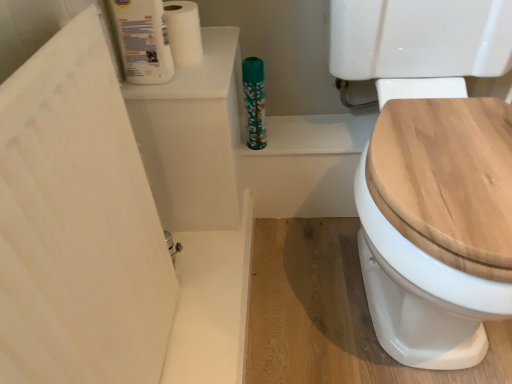
Measure the distance between point (247, 72) and camera.

→ The distance of point (247, 72) from camera is 38.90 inches.

Identify the location of white glossy toilet paper at upper left, the first toilet paper in the front-to-back sequence. (156, 38).

You are a GUI agent. You are given a task and a screenshot of the screen. Output one action in this format:
    pyautogui.click(x=<x>, y=<y>)
    Task: Click on the teal floral-patterned bottle at upper center
    
    Given the screenshot: What is the action you would take?
    pyautogui.click(x=254, y=101)

From a real-world perspective, is white matte toilet paper at upper left, the first toilet paper in the back-to-front sequence, on teal floral-patterned bottle at upper center?

Yes, from a real-world perspective, white matte toilet paper at upper left, the first toilet paper in the back-to-front sequence, is over teal floral-patterned bottle at upper center

Is white matte toilet paper at upper left, positioned as the second toilet paper in front-to-back order, facing towards teal floral-patterned bottle at upper center?

No, white matte toilet paper at upper left, positioned as the second toilet paper in front-to-back order, is not turned towards teal floral-patterned bottle at upper center.

Considering the sizes of objects white matte toilet paper at upper left, the first toilet paper in the back-to-front sequence, and teal floral-patterned bottle at upper center in the image provided, who is smaller, white matte toilet paper at upper left, the first toilet paper in the back-to-front sequence, or teal floral-patterned bottle at upper center?

Smaller between the two is teal floral-patterned bottle at upper center.

Would you say teal floral-patterned bottle at upper center is part of white matte toilet paper at upper left, positioned as the second toilet paper in front-to-back order,'s contents?

No, teal floral-patterned bottle at upper center is not a part of white matte toilet paper at upper left, positioned as the second toilet paper in front-to-back order.

From a real-world perspective, is white matte toilet paper at upper left, positioned as the second toilet paper in front-to-back order, located beneath white glossy toilet paper at upper left, placed as the second toilet paper when sorted from back to front?

Correct, in the physical world, white matte toilet paper at upper left, positioned as the second toilet paper in front-to-back order, is lower than white glossy toilet paper at upper left, placed as the second toilet paper when sorted from back to front.

Is white matte toilet paper at upper left, positioned as the second toilet paper in front-to-back order, next to white glossy toilet paper at upper left, the first toilet paper in the front-to-back sequence?

Yes, white matte toilet paper at upper left, positioned as the second toilet paper in front-to-back order, is next to white glossy toilet paper at upper left, the first toilet paper in the front-to-back sequence.

Does point (168, 12) come behind point (141, 15)?

Yes, point (168, 12) is behind point (141, 15).

Who is bigger, teal floral-patterned bottle at upper center or wooden toilet seat at right?

wooden toilet seat at right.

Considering the sizes of objects teal floral-patterned bottle at upper center and wooden toilet seat at right in the image provided, who is thinner, teal floral-patterned bottle at upper center or wooden toilet seat at right?

teal floral-patterned bottle at upper center is thinner.

Is teal floral-patterned bottle at upper center positioned beyond the bounds of wooden toilet seat at right?

That's correct, teal floral-patterned bottle at upper center is outside of wooden toilet seat at right.

From their relative heights in the image, would you say teal floral-patterned bottle at upper center is taller or shorter than wooden toilet seat at right?

In the image, teal floral-patterned bottle at upper center appears to be shorter than wooden toilet seat at right.

How far apart are white glossy toilet paper at upper left, the first toilet paper in the front-to-back sequence, and white matte toilet paper at upper left, the first toilet paper in the back-to-front sequence?

A distance of 3.85 centimeters exists between white glossy toilet paper at upper left, the first toilet paper in the front-to-back sequence, and white matte toilet paper at upper left, the first toilet paper in the back-to-front sequence.

Does white glossy toilet paper at upper left, the first toilet paper in the front-to-back sequence, have a greater height compared to white matte toilet paper at upper left, positioned as the second toilet paper in front-to-back order?

Yes, white glossy toilet paper at upper left, the first toilet paper in the front-to-back sequence, is taller than white matte toilet paper at upper left, positioned as the second toilet paper in front-to-back order.

Is point (128, 74) more distant than point (172, 14)?

No, it is in front of (172, 14).

Looking at their sizes, would you say white glossy toilet paper at upper left, placed as the second toilet paper when sorted from back to front, is wider or thinner than white matte toilet paper at upper left, positioned as the second toilet paper in front-to-back order?

Clearly, white glossy toilet paper at upper left, placed as the second toilet paper when sorted from back to front, has less width compared to white matte toilet paper at upper left, positioned as the second toilet paper in front-to-back order.

Between teal floral-patterned bottle at upper center and white glossy toilet paper at upper left, placed as the second toilet paper when sorted from back to front, which one has less height?

Standing shorter between the two is teal floral-patterned bottle at upper center.

Is teal floral-patterned bottle at upper center completely or partially outside of white glossy toilet paper at upper left, placed as the second toilet paper when sorted from back to front?

Yes.

Which is behind, point (254, 87) or point (116, 20)?

The point (254, 87) is behind.

Is white glossy toilet paper at upper left, placed as the second toilet paper when sorted from back to front, at the back of teal floral-patterned bottle at upper center?

teal floral-patterned bottle at upper center is not turned away from white glossy toilet paper at upper left, placed as the second toilet paper when sorted from back to front.

Considering their positions, is wooden toilet seat at right located in front of or behind white glossy toilet paper at upper left, the first toilet paper in the front-to-back sequence?

Clearly, wooden toilet seat at right is in front of white glossy toilet paper at upper left, the first toilet paper in the front-to-back sequence.

From a real-world perspective, relative to white glossy toilet paper at upper left, the first toilet paper in the front-to-back sequence, is wooden toilet seat at right vertically above or below?

wooden toilet seat at right is below white glossy toilet paper at upper left, the first toilet paper in the front-to-back sequence.

Considering the relative sizes of wooden toilet seat at right and white glossy toilet paper at upper left, the first toilet paper in the front-to-back sequence, in the image provided, is wooden toilet seat at right thinner than white glossy toilet paper at upper left, the first toilet paper in the front-to-back sequence,?

Incorrect, the width of wooden toilet seat at right is not less than that of white glossy toilet paper at upper left, the first toilet paper in the front-to-back sequence.

From the image's perspective, which one is positioned higher, wooden toilet seat at right or white glossy toilet paper at upper left, the first toilet paper in the front-to-back sequence?

white glossy toilet paper at upper left, the first toilet paper in the front-to-back sequence, appears higher in the image.

Can you confirm if white glossy toilet paper at upper left, placed as the second toilet paper when sorted from back to front, is positioned to the right of wooden toilet seat at right?

Incorrect, white glossy toilet paper at upper left, placed as the second toilet paper when sorted from back to front, is not on the right side of wooden toilet seat at right.

Are white glossy toilet paper at upper left, the first toilet paper in the front-to-back sequence, and wooden toilet seat at right beside each other?

They are not placed beside each other.

Is point (195, 34) less distant than point (435, 246)?

No, it is behind (435, 246).

Considering the relative sizes of white glossy toilet paper at upper left, the first toilet paper in the front-to-back sequence, and wooden toilet seat at right in the image provided, is white glossy toilet paper at upper left, the first toilet paper in the front-to-back sequence, wider than wooden toilet seat at right?

No, white glossy toilet paper at upper left, the first toilet paper in the front-to-back sequence, is not wider than wooden toilet seat at right.

Find the location of a particular element. The height and width of the screenshot is (384, 512). cleaning product on the right of white matte toilet paper at upper left, the first toilet paper in the back-to-front sequence is located at coordinates (254, 101).

This screenshot has width=512, height=384. Find the location of `toilet paper located underneath the white glossy toilet paper at upper left, placed as the second toilet paper when sorted from back to front (from a real-world perspective)`. toilet paper located underneath the white glossy toilet paper at upper left, placed as the second toilet paper when sorted from back to front (from a real-world perspective) is located at coordinates (183, 32).

From the image, which object appears to be nearer to white glossy toilet paper at upper left, placed as the second toilet paper when sorted from back to front, wooden toilet seat at right or teal floral-patterned bottle at upper center?

teal floral-patterned bottle at upper center is positioned closer to the anchor white glossy toilet paper at upper left, placed as the second toilet paper when sorted from back to front.

Considering their positions, is wooden toilet seat at right positioned further to white matte toilet paper at upper left, the first toilet paper in the back-to-front sequence, than white glossy toilet paper at upper left, the first toilet paper in the front-to-back sequence?

wooden toilet seat at right.

Estimate the real-world distances between objects in this image. Which object is further from white glossy toilet paper at upper left, the first toilet paper in the front-to-back sequence, white matte toilet paper at upper left, positioned as the second toilet paper in front-to-back order, or teal floral-patterned bottle at upper center?

Among the two, teal floral-patterned bottle at upper center is located further to white glossy toilet paper at upper left, the first toilet paper in the front-to-back sequence.

Estimate the real-world distances between objects in this image. Which object is further from teal floral-patterned bottle at upper center, white glossy toilet paper at upper left, the first toilet paper in the front-to-back sequence, or white matte toilet paper at upper left, positioned as the second toilet paper in front-to-back order?

white glossy toilet paper at upper left, the first toilet paper in the front-to-back sequence, lies further to teal floral-patterned bottle at upper center than the other object.

Based on their spatial positions, is white matte toilet paper at upper left, positioned as the second toilet paper in front-to-back order, or white glossy toilet paper at upper left, the first toilet paper in the front-to-back sequence, further from wooden toilet seat at right?

The object further to wooden toilet seat at right is white matte toilet paper at upper left, positioned as the second toilet paper in front-to-back order.

Estimate the real-world distances between objects in this image. Which object is closer to white glossy toilet paper at upper left, the first toilet paper in the front-to-back sequence, wooden toilet seat at right or white matte toilet paper at upper left, positioned as the second toilet paper in front-to-back order?

white matte toilet paper at upper left, positioned as the second toilet paper in front-to-back order, is positioned closer to the anchor white glossy toilet paper at upper left, the first toilet paper in the front-to-back sequence.

Which object lies nearer to the anchor point white matte toilet paper at upper left, positioned as the second toilet paper in front-to-back order, white glossy toilet paper at upper left, the first toilet paper in the front-to-back sequence, or wooden toilet seat at right?

Among the two, white glossy toilet paper at upper left, the first toilet paper in the front-to-back sequence, is located nearer to white matte toilet paper at upper left, positioned as the second toilet paper in front-to-back order.

From the image, which object appears to be farther from white matte toilet paper at upper left, the first toilet paper in the back-to-front sequence, wooden toilet seat at right or teal floral-patterned bottle at upper center?

wooden toilet seat at right is further to white matte toilet paper at upper left, the first toilet paper in the back-to-front sequence.

Locate an element on the screen. The image size is (512, 384). toilet paper between white glossy toilet paper at upper left, the first toilet paper in the front-to-back sequence, and wooden toilet seat at right from left to right is located at coordinates (183, 32).

In order to click on toilet paper between white glossy toilet paper at upper left, placed as the second toilet paper when sorted from back to front, and teal floral-patterned bottle at upper center, along the z-axis in this screenshot , I will do `click(183, 32)`.